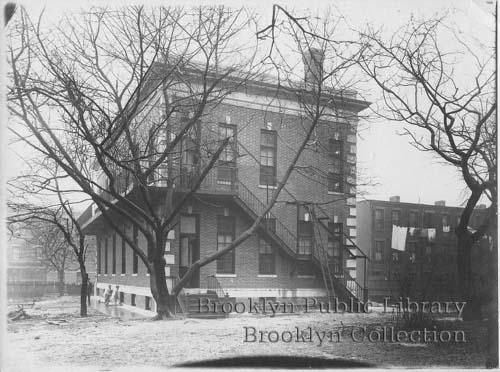
Find the location of a particular element. This screenshot has height=372, width=500. bottom floor front middle window is located at coordinates (301, 249).